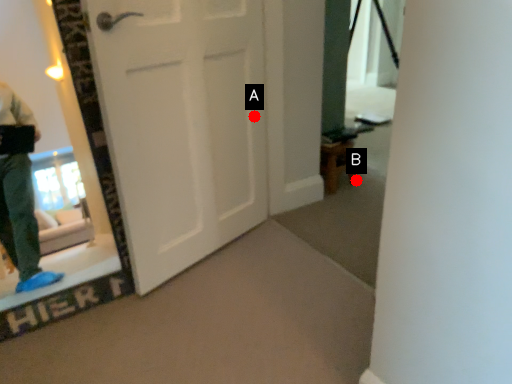
Question: Two points are circled on the image, labeled by A and B beside each circle. Which point appears farthest from the camera in this image?

Choices:
 (A) A is further
 (B) B is further

Answer: (B)